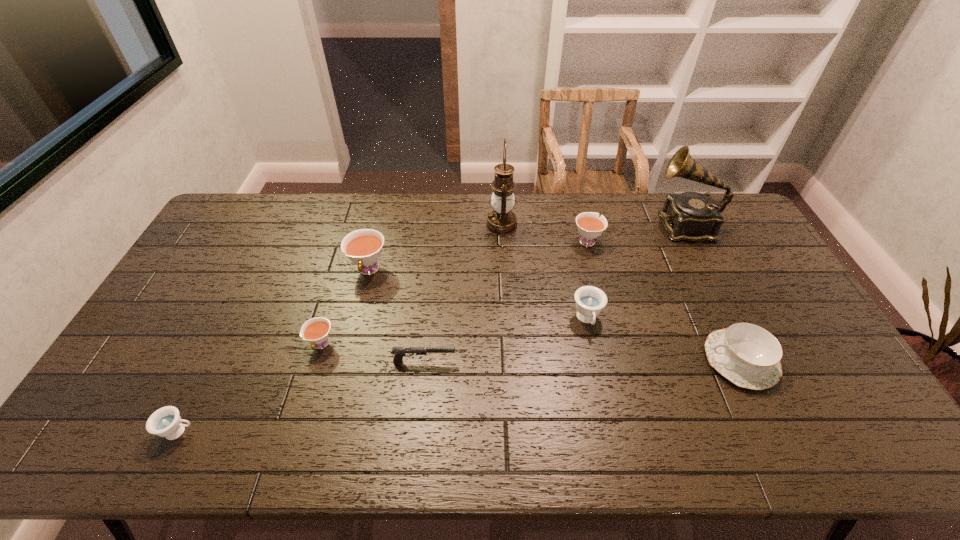
Locate an element on the screen. vacant space in between the gray gun and the blue chinaware is located at coordinates (582, 361).

Where is `free spot between the oil lamp and the fourth nearest teacup`? Image resolution: width=960 pixels, height=540 pixels. free spot between the oil lamp and the fourth nearest teacup is located at coordinates (435, 247).

Identify the location of unoccupied area between the gray gun and the blue chinaware. (582, 361).

Identify which object is the seventh nearest to the phonograph record. Please provide its 2D coordinates. Your answer should be formatted as a tuple, i.e. [(x, y)], where the tuple contains the x and y coordinates of a point satisfying the conditions above.

[(316, 330)]

Where is `object that is the third closest to the fourth object from left to right`? Image resolution: width=960 pixels, height=540 pixels. object that is the third closest to the fourth object from left to right is located at coordinates (590, 300).

Find the location of a particular element. teacup that can be found as the fifth closest to the chinaware is located at coordinates (166, 422).

Select which teacup appears as the fifth closest to the phonograph record. Please provide its 2D coordinates. Your answer should be formatted as a tuple, i.e. [(x, y)], where the tuple contains the x and y coordinates of a point satisfying the conditions above.

[(166, 422)]

Identify which white teacup is located as the second nearest to the nearest white teacup. Please provide its 2D coordinates. Your answer should be formatted as a tuple, i.e. [(x, y)], where the tuple contains the x and y coordinates of a point satisfying the conditions above.

[(590, 226)]

Select which white teacup is the closest to the nearest white teacup. Please provide its 2D coordinates. Your answer should be formatted as a tuple, i.e. [(x, y)], where the tuple contains the x and y coordinates of a point satisfying the conditions above.

[(363, 247)]

Locate an element on the screen. vacant space that satisfies the following two spatial constraints: 1. on the horn of the second tallest object; 2. on the side of the nearest white teacup with the handle is located at coordinates (745, 345).